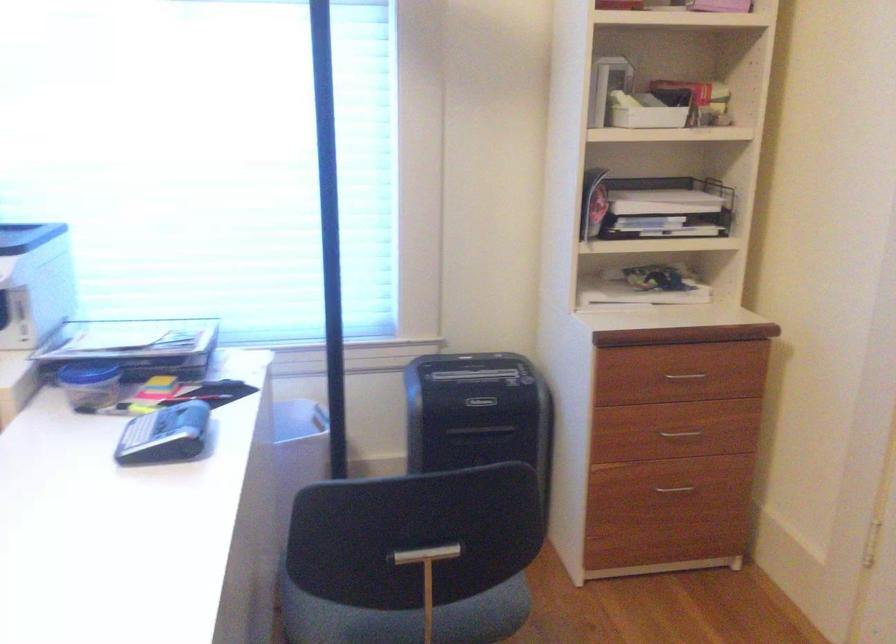
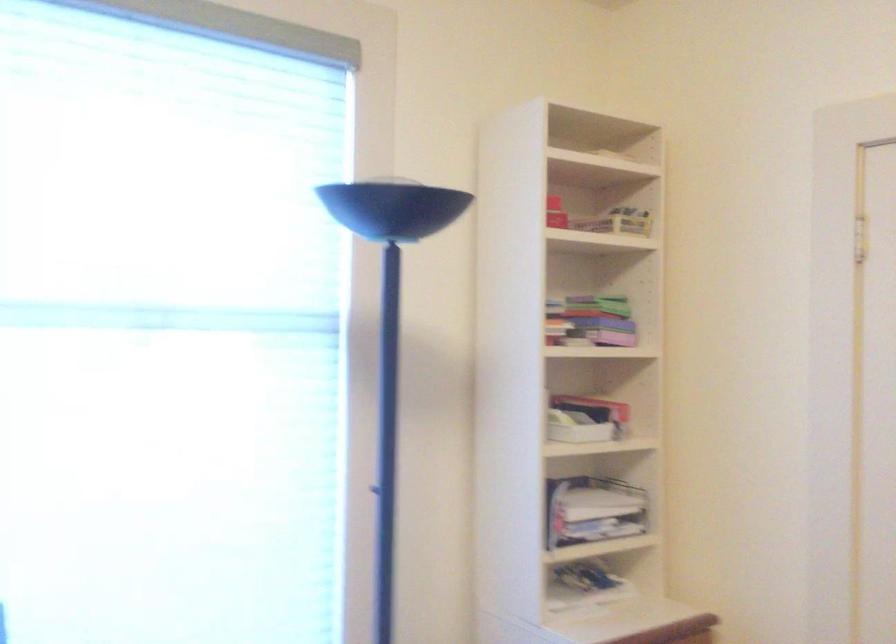
In the second image, find the point that corresponds to the point at 645,205 in the first image.

(592, 509)